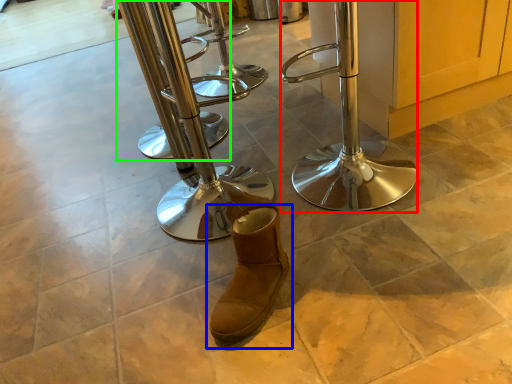
Question: Which object is the closest to the step stool (highlighted by a red box)? Choose among these: footwear (highlighted by a blue box) or step stool (highlighted by a green box).

Choices:
 (A) footwear
 (B) step stool

Answer: (A)